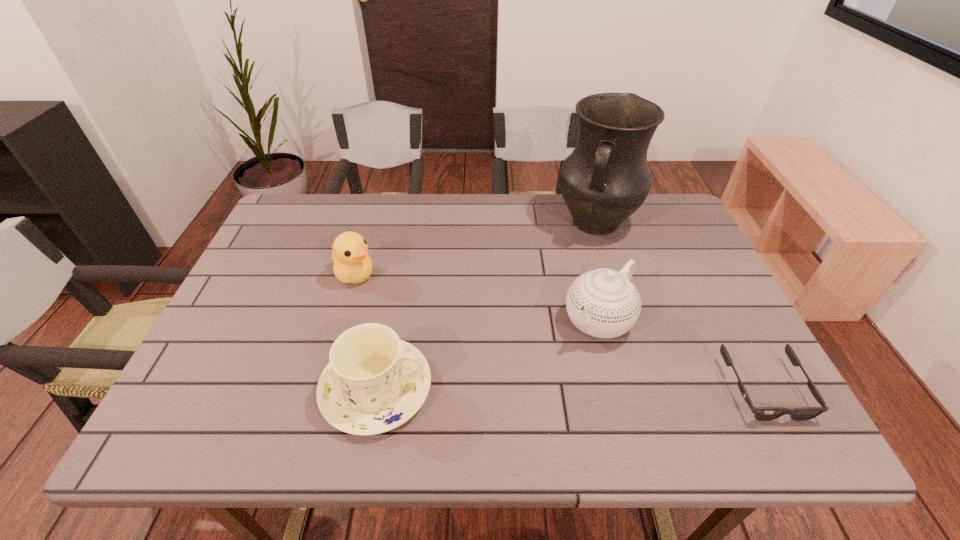
You are a GUI agent. You are given a task and a screenshot of the screen. Output one action in this format:
    pyautogui.click(x=<x>, y=<y>)
    Task: Click on the left chinaware
    
    Given the screenshot: What is the action you would take?
    pyautogui.click(x=374, y=382)

You are a GUI agent. You are given a task and a screenshot of the screen. Output one action in this format:
    pyautogui.click(x=<x>, y=<y>)
    Task: Click on the sunglasses
    This screenshot has height=540, width=960.
    Given the screenshot: What is the action you would take?
    pyautogui.click(x=760, y=413)

Image resolution: width=960 pixels, height=540 pixels. I want to click on the rightmost object, so click(760, 413).

The width and height of the screenshot is (960, 540). I want to click on the right chinaware, so click(604, 303).

Where is `the fourth nearest object`? This screenshot has width=960, height=540. the fourth nearest object is located at coordinates (352, 264).

Find the location of a particular element. This screenshot has height=540, width=960. pitcher is located at coordinates (606, 178).

The width and height of the screenshot is (960, 540). In order to click on the tallest object in this screenshot , I will do `click(606, 178)`.

Find the location of `free space located on the handle side of the left chinaware`. free space located on the handle side of the left chinaware is located at coordinates (544, 388).

Find the location of `free space located 0.170m on the spout of the taller chinaware`. free space located 0.170m on the spout of the taller chinaware is located at coordinates (532, 387).

Find the location of a particular element. free space located on the spout of the taller chinaware is located at coordinates (560, 359).